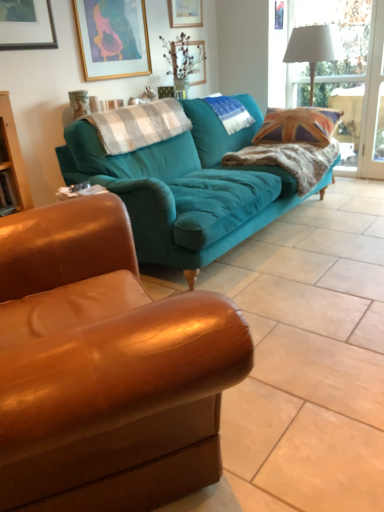
Question: Considering the positions of clear glass window at upper right and union jack fabric pillow at right in the image, is clear glass window at upper right taller or shorter than union jack fabric pillow at right?

Choices:
 (A) tall
 (B) short

Answer: (A)

Question: From the image's perspective, is clear glass window at upper right above or below union jack fabric pillow at right?

Choices:
 (A) above
 (B) below

Answer: (A)

Question: Which is farther from the wooden picture frame at upper center, marked as the 2th picture frame in a bottom-to-top arrangement?

Choices:
 (A) teal fabric couch at center, arranged as the 2th studio couch when viewed from the back
 (B) white fabric lampshade at upper right
 (C) plaid fabric pillow at center, which appears as the 1th pillow when viewed from the front
 (D) union jack fabric pillow at right
 (E) clear glass window at upper right

Answer: (A)

Question: Considering the real-world distances, which object is closest to the teal fabric couch at center, the 1th studio couch positioned from the back?

Choices:
 (A) gold-framed artwork at upper center, which is the 2th picture frame from right to left
 (B) wooden picture frame at upper center, the 1th picture frame in the right-to-left sequence
 (C) white fabric lampshade at upper right
 (D) teal fabric pillow at center, the 1th pillow when ordered from back to front
 (E) clear glass window at upper right

Answer: (D)